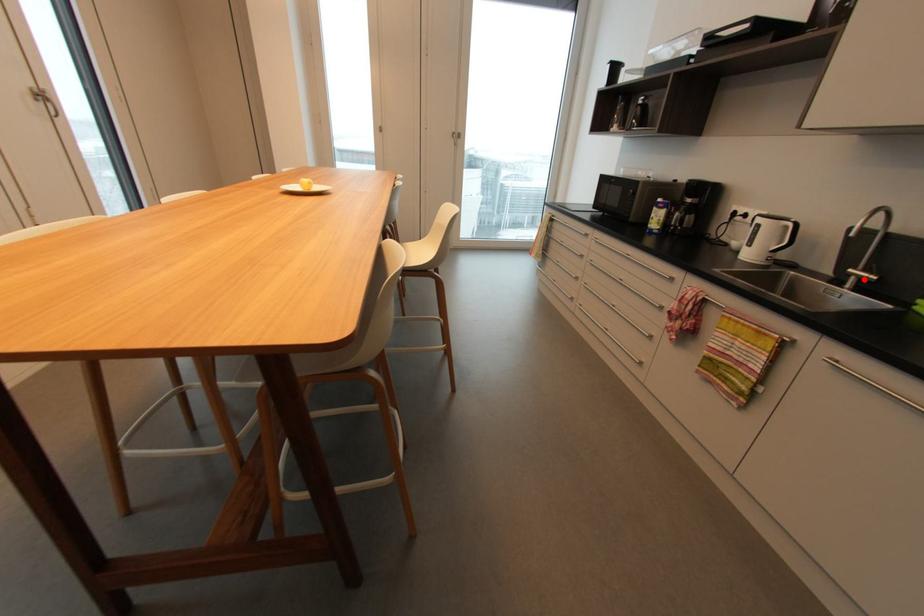
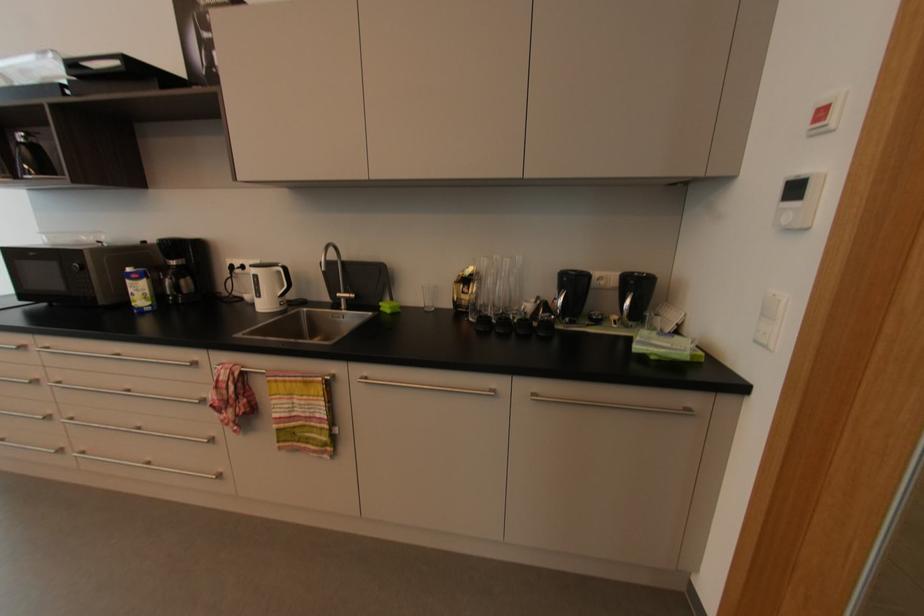
Find the pixel in the second image that matches the highlighted location in the first image.

(350, 300)